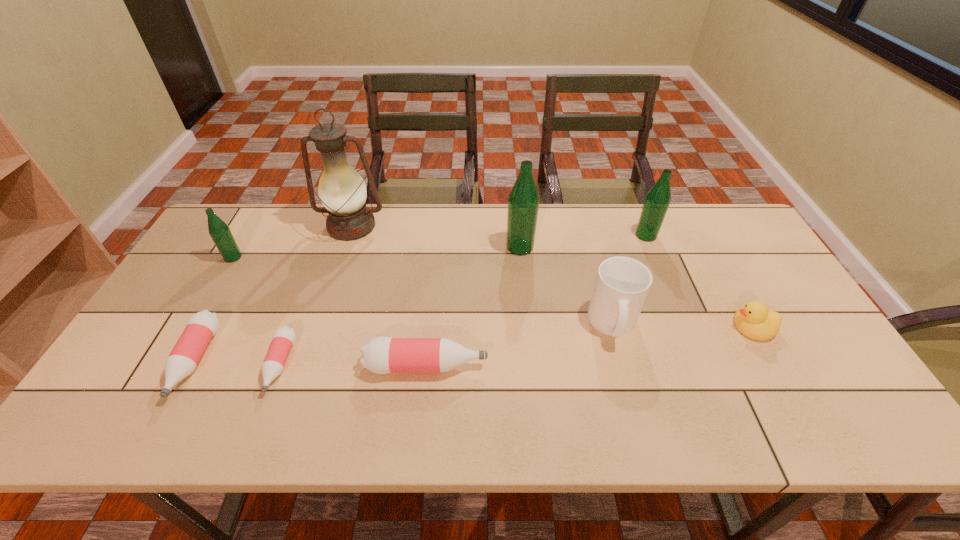
Identify the location of free region located 0.180m on the right of the smallest green bottle. (x=300, y=258).

Where is `vacant space located 0.090m on the handle side of the white mug`? The image size is (960, 540). vacant space located 0.090m on the handle side of the white mug is located at coordinates (629, 382).

Identify the location of free space located 0.370m with the cap open on the biggest pink bottle. This screenshot has height=540, width=960. (638, 366).

Locate an element on the screen. Image resolution: width=960 pixels, height=540 pixels. blank space located on the face of the rightmost object is located at coordinates (584, 326).

Identify the location of vacant space located on the face of the rightmost object. The width and height of the screenshot is (960, 540). (685, 326).

What are the coordinates of `vacant space located 0.290m on the face of the rightmost object` in the screenshot? It's located at point(621,326).

Locate an element on the screen. Image resolution: width=960 pixels, height=540 pixels. vacant space located 0.070m with the cap open on the second shortest bottle is located at coordinates (155, 434).

Locate an element on the screen. The width and height of the screenshot is (960, 540). oil lamp present at the far edge is located at coordinates (342, 190).

You are a GUI agent. You are given a task and a screenshot of the screen. Output one action in this format:
    pyautogui.click(x=<x>, y=<y>)
    Task: Click on the object present at the near edge
    This screenshot has height=540, width=960.
    Given the screenshot: What is the action you would take?
    pyautogui.click(x=202, y=326)

At what (x,y) coordinates should I click in order to perform the action: click on object situated at the right edge. Please return your answer as a coordinate pair (x, y). The image size is (960, 540). Looking at the image, I should click on (754, 320).